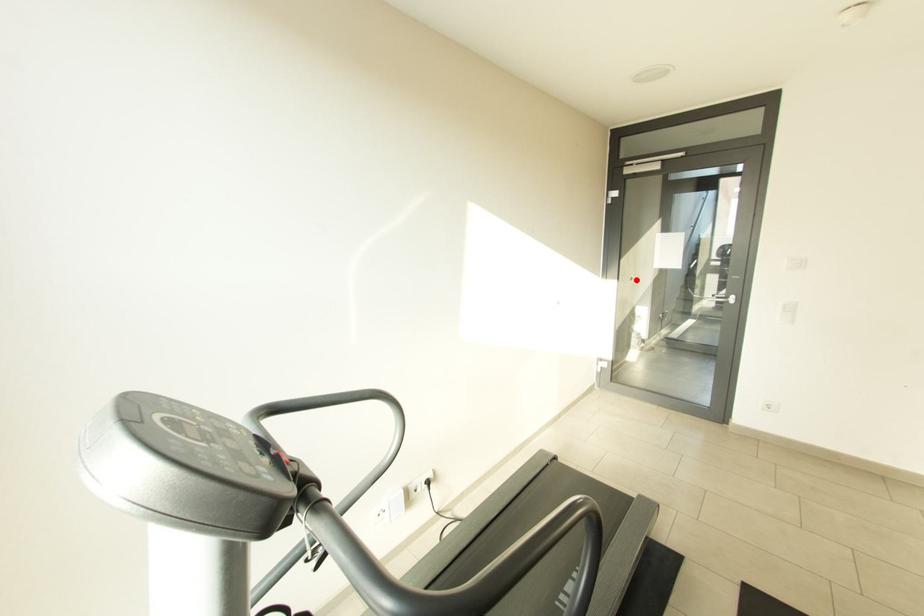
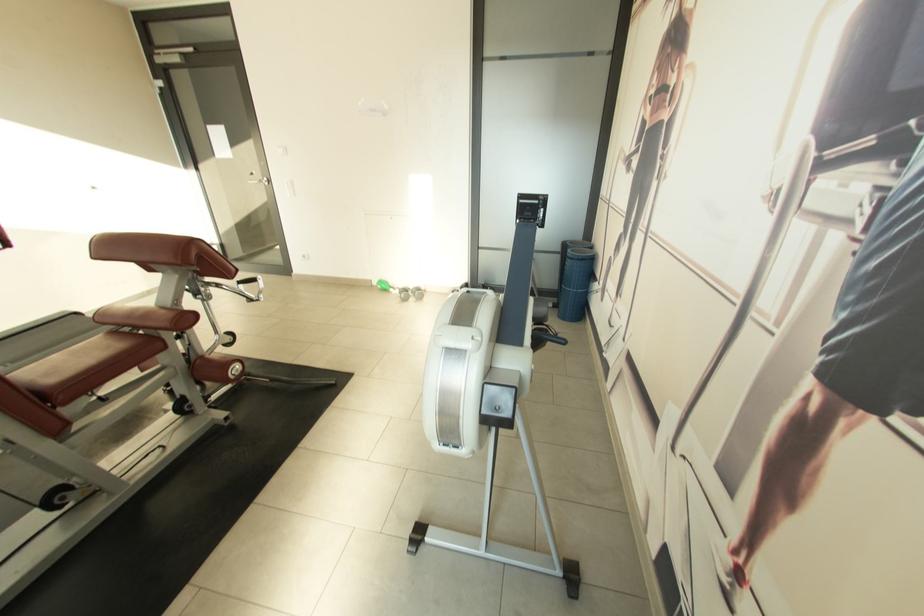
The point at the highlighted location is marked in the first image. Where is the corresponding point in the second image?

(258, 175)